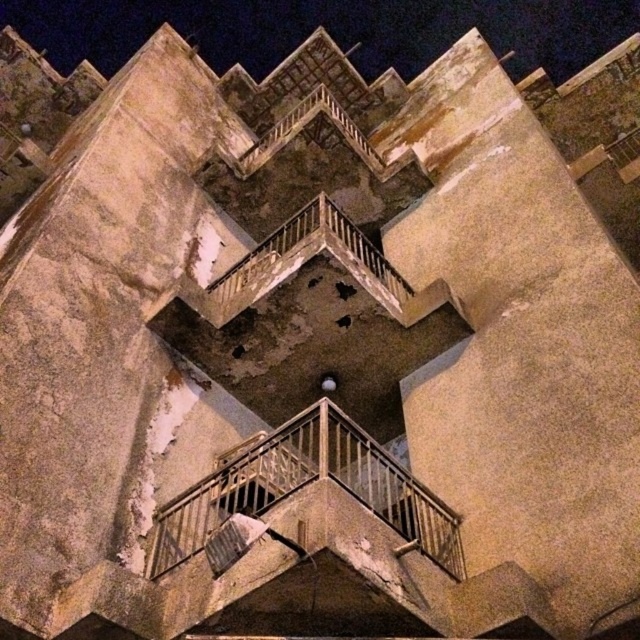
Can you confirm if rusty metal balcony at center is thinner than rusty metal balcony at upper center?

Incorrect, rusty metal balcony at center's width is not less than rusty metal balcony at upper center's.

Where is `rusty metal balcony at center`? This screenshot has height=640, width=640. rusty metal balcony at center is located at coordinates (307, 483).

Between point (288, 435) and point (246, 273), which one is positioned behind?

The point (246, 273) is more distant.

This screenshot has height=640, width=640. Find the location of `rusty metal balcony at center`. rusty metal balcony at center is located at coordinates (307, 483).